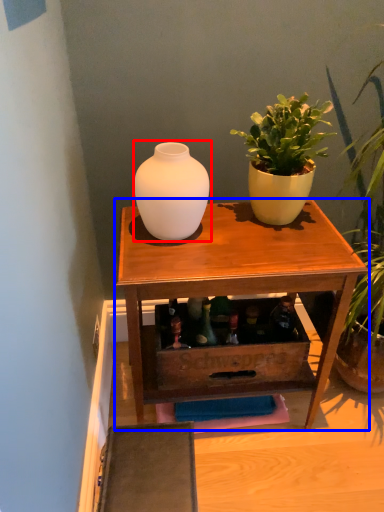
Question: Which of the following is the closest to the observer, vase (highlighted by a red box) or table (highlighted by a blue box)?

Choices:
 (A) vase
 (B) table

Answer: (A)